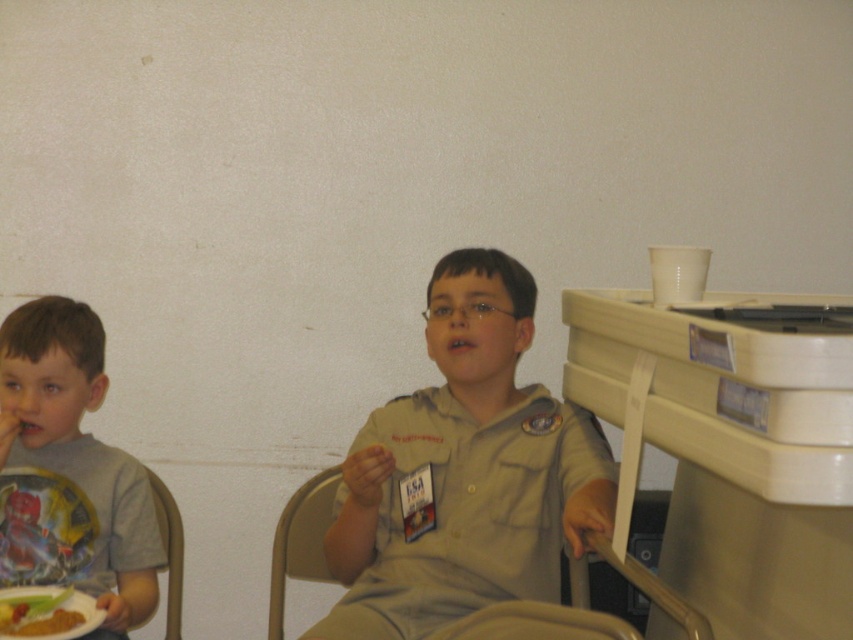
You are a photographer trying to capture a candid shot of the two boys. To ensure both are in frame, you need to position yourself between the white plastic table at right and the metallic gray chair at center. Which object should you stand closer to if you want to include more of the background in your photo?

You should stand closer to the metallic gray chair at center because the white plastic table at right is positioned on the right side of it, allowing more background space when closer to the chair.

You are a photographer standing at the entrance of the room where the two boys are seated. You need to capture a photo that includes both boys and the white plastic table at right. Based on their positions, will the table be positioned to the left or right side of the photo?

The white plastic table at right is located at point (733,445), which is towards the right side of the image. Therefore, in the photo, the table will be positioned on the right side.

Looking at the scene, where is the khaki uniform shirt at center in relation to the golden brown bread at lower left?

The khaki uniform shirt at center is above the golden brown bread at lower left.